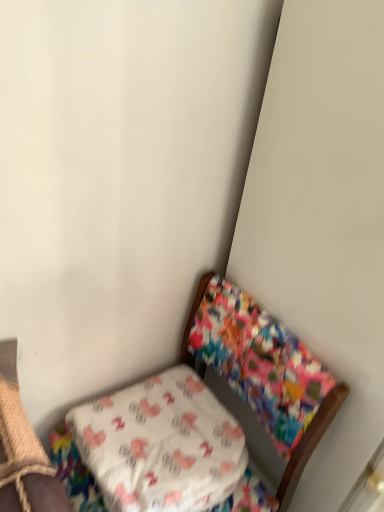
What do you see at coordinates (155, 449) in the screenshot?
I see `floral fabric chair at lower right` at bounding box center [155, 449].

The width and height of the screenshot is (384, 512). Identify the location of floral fabric chair at lower right. (155, 449).

Find the location of `white fabric pillow at lower left`. white fabric pillow at lower left is located at coordinates (161, 445).

What do you see at coordinates (161, 445) in the screenshot? The image size is (384, 512). I see `white fabric pillow at lower left` at bounding box center [161, 445].

I want to click on floral fabric chair at lower right, so click(155, 449).

Which object is positioned more to the right, floral fabric chair at lower right or white fabric pillow at lower left?

From the viewer's perspective, floral fabric chair at lower right appears more on the right side.

Is the position of floral fabric chair at lower right less distant than that of white fabric pillow at lower left?

Yes, it is.

Looking at this image, which is closer, (x=308, y=373) or (x=88, y=446)?

Point (x=308, y=373) is positioned closer to the camera compared to point (x=88, y=446).

From the image's perspective, which one is positioned higher, floral fabric chair at lower right or white fabric pillow at lower left?

white fabric pillow at lower left appears higher in the image.

From a real-world perspective, which is physically above, floral fabric chair at lower right or white fabric pillow at lower left?

From a 3D spatial view, white fabric pillow at lower left is above.

Between floral fabric chair at lower right and white fabric pillow at lower left, which one has smaller width?

Thinner between the two is white fabric pillow at lower left.

Based on the photo, between floral fabric chair at lower right and white fabric pillow at lower left, which one has less height?

white fabric pillow at lower left.

Does floral fabric chair at lower right have a smaller size compared to white fabric pillow at lower left?

Actually, floral fabric chair at lower right might be larger than white fabric pillow at lower left.

Can white fabric pillow at lower left be found inside floral fabric chair at lower right?

Yes, white fabric pillow at lower left is surrounded by floral fabric chair at lower right.

Is floral fabric chair at lower right beside white fabric pillow at lower left?

Indeed, floral fabric chair at lower right and white fabric pillow at lower left are beside each other and touching.

Is white fabric pillow at lower left at the back of floral fabric chair at lower right?

Yes, floral fabric chair at lower right is facing away from white fabric pillow at lower left.

How different are the orientations of floral fabric chair at lower right and white fabric pillow at lower left in degrees?

The facing directions of floral fabric chair at lower right and white fabric pillow at lower left are 89 degrees apart.

Locate an element on the screen. The height and width of the screenshot is (512, 384). furniture located underneath the white fabric pillow at lower left (from a real-world perspective) is located at coordinates (155, 449).

Is white fabric pillow at lower left to the right of floral fabric chair at lower right from the viewer's perspective?

No, white fabric pillow at lower left is not to the right of floral fabric chair at lower right.

Which is behind, white fabric pillow at lower left or floral fabric chair at lower right?

Positioned behind is white fabric pillow at lower left.

Is point (157, 429) farther from camera compared to point (107, 416)?

Yes, it is behind point (107, 416).

From the image's perspective, between white fabric pillow at lower left and floral fabric chair at lower right, which one is located above?

white fabric pillow at lower left appears higher in the image.

From a real-world perspective, relative to floral fabric chair at lower right, is white fabric pillow at lower left vertically above or below?

Clearly, from a real-world perspective, white fabric pillow at lower left is above floral fabric chair at lower right.

Can you confirm if white fabric pillow at lower left is thinner than floral fabric chair at lower right?

Yes.

Does white fabric pillow at lower left have a greater height compared to floral fabric chair at lower right?

Incorrect, the height of white fabric pillow at lower left is not larger of that of floral fabric chair at lower right.

Can you confirm if white fabric pillow at lower left is bigger than floral fabric chair at lower right?

Incorrect, white fabric pillow at lower left is not larger than floral fabric chair at lower right.

Is floral fabric chair at lower right located within white fabric pillow at lower left?

That's incorrect, floral fabric chair at lower right is not inside white fabric pillow at lower left.

Are white fabric pillow at lower left and floral fabric chair at lower right beside each other?

Yes.

Is white fabric pillow at lower left turned away from floral fabric chair at lower right?

Yes, white fabric pillow at lower left is facing away from floral fabric chair at lower right.

How much distance is there between white fabric pillow at lower left and floral fabric chair at lower right?

They are 1.41 inches apart.

Find the location of `pillow above the floral fabric chair at lower right (from the image's perspective)`. pillow above the floral fabric chair at lower right (from the image's perspective) is located at coordinates (161, 445).

I want to click on pillow positioned vertically above the floral fabric chair at lower right (from a real-world perspective), so click(161, 445).

Where is `pillow above the floral fabric chair at lower right (from the image's perspective)`? pillow above the floral fabric chair at lower right (from the image's perspective) is located at coordinates (161, 445).